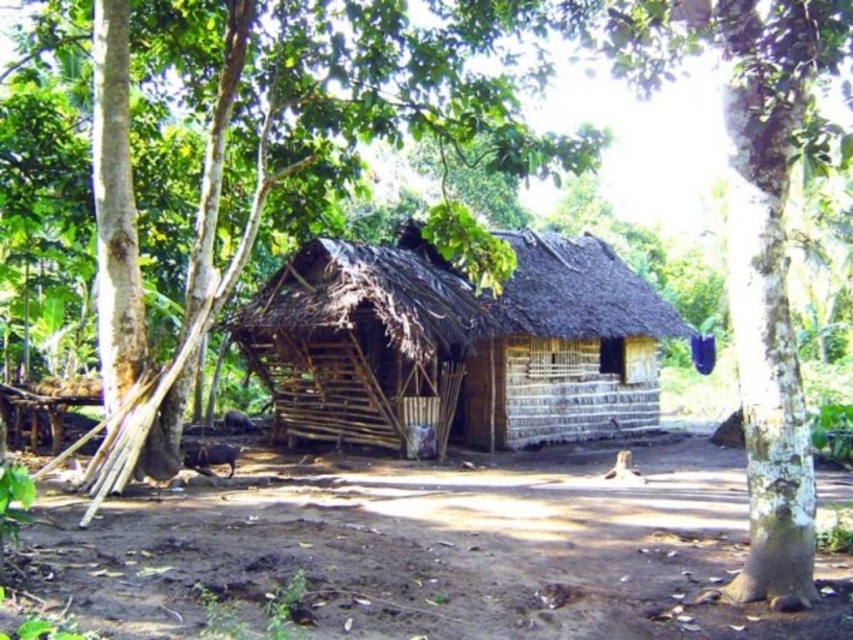
Question: Which object is farther from the camera taking this photo?

Choices:
 (A) brown wood tree at center
 (B) wooden hut at center

Answer: (B)

Question: Can you confirm if brown dirt field at center is smaller than wooden hut at center?

Choices:
 (A) yes
 (B) no

Answer: (A)

Question: Is brown dirt field at center positioned in front of wooden hut at center?

Choices:
 (A) no
 (B) yes

Answer: (B)

Question: Estimate the real-world distances between objects in this image. Which object is closer to the brown dirt field at center?

Choices:
 (A) brown wood tree at center
 (B) wooden hut at center

Answer: (A)

Question: Considering the relative positions of brown wood tree at center and wooden hut at center in the image provided, where is brown wood tree at center located with respect to wooden hut at center?

Choices:
 (A) below
 (B) above

Answer: (B)

Question: Which object is positioned farthest from the brown wood tree at center?

Choices:
 (A) brown dirt field at center
 (B) wooden hut at center

Answer: (A)